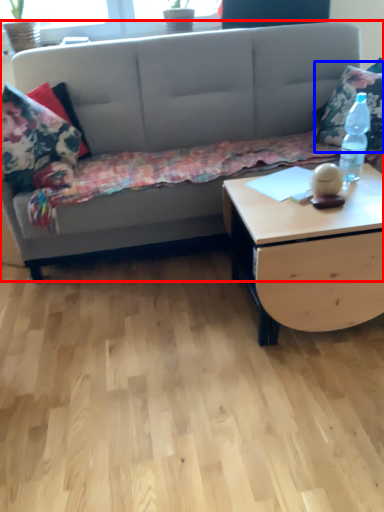
Question: Which point is closer to the camera, studio couch (highlighted by a red box) or throw pillow (highlighted by a blue box)?

Choices:
 (A) studio couch
 (B) throw pillow

Answer: (A)